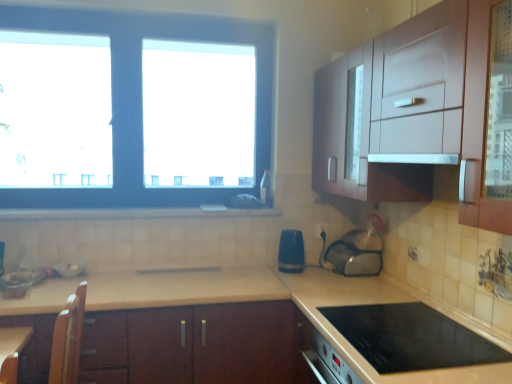
This screenshot has height=384, width=512. I want to click on free area in between transparent plastic bag at center, marked as the 1th appliance in a right-to-left arrangement, and blue plastic toaster at center, which is the 2th appliance from right to left, so click(320, 271).